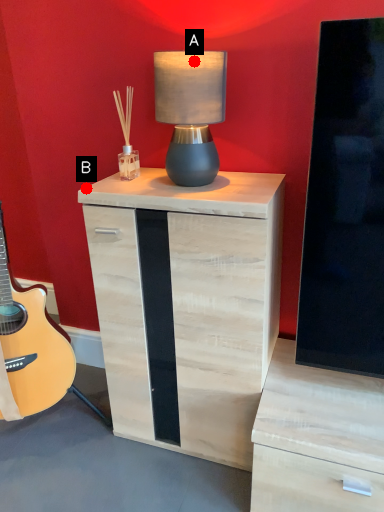
Question: Two points are circled on the image, labeled by A and B beside each circle. Which point appears closest to the camera in this image?

Choices:
 (A) A is closer
 (B) B is closer

Answer: (A)